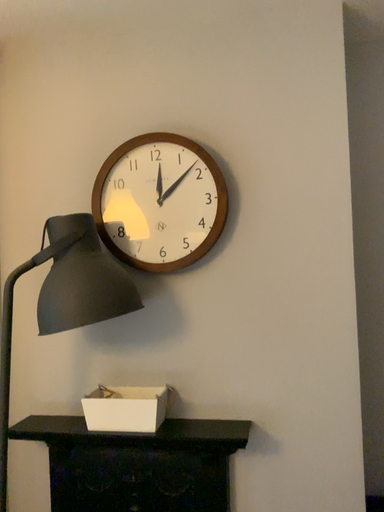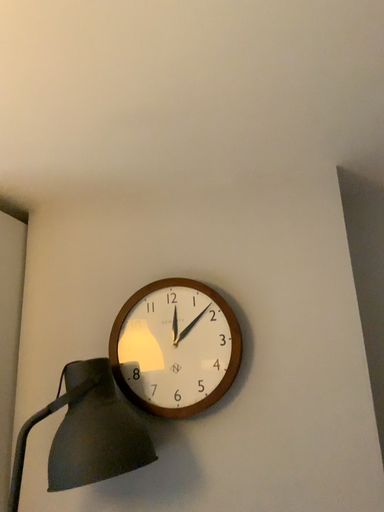
Question: How did the camera likely rotate when shooting the video?

Choices:
 (A) rotated upward
 (B) rotated downward

Answer: (A)